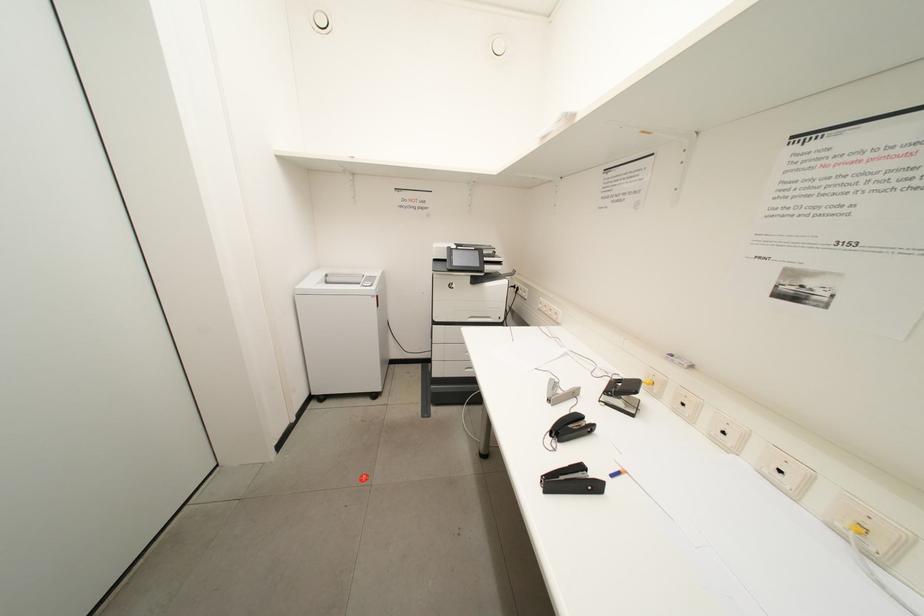
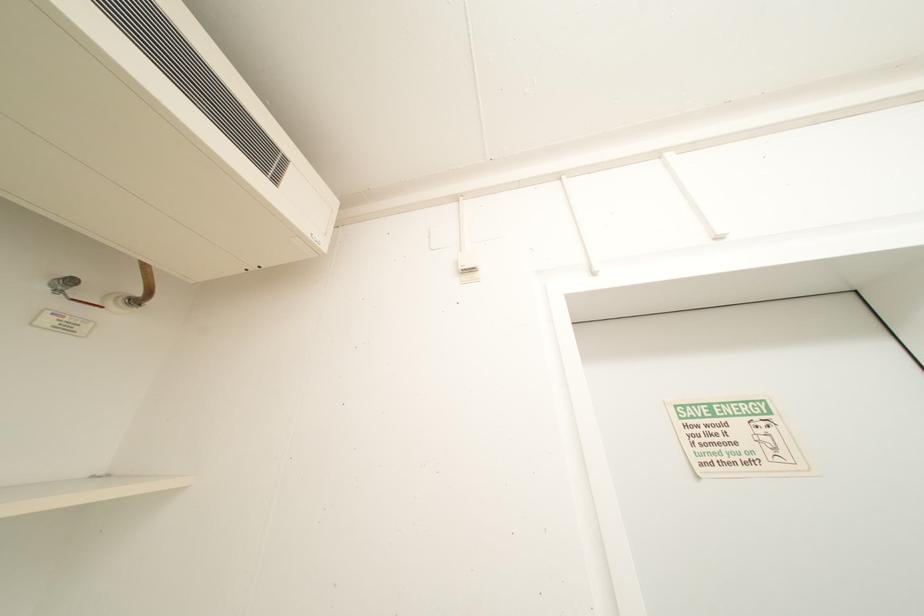
Based on the continuous images, in which direction is the camera rotating?

The rotation direction of the camera is left-up.